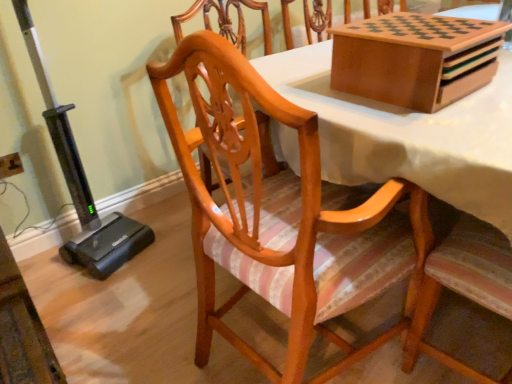
Question: In terms of width, does wooden game board at upper right look wider or thinner when compared to matte wood chair at center?

Choices:
 (A) wide
 (B) thin

Answer: (B)

Question: Would you say wooden game board at upper right is to the left or to the right of matte wood chair at center in the picture?

Choices:
 (A) left
 (B) right

Answer: (B)

Question: From their relative heights in the image, would you say wooden game board at upper right is taller or shorter than matte wood chair at center?

Choices:
 (A) short
 (B) tall

Answer: (A)

Question: Choose the correct answer: Is matte wood chair at center inside wooden game board at upper right or outside it?

Choices:
 (A) inside
 (B) outside

Answer: (B)

Question: In the image, is matte wood chair at center on the left side or the right side of wooden game board at upper right?

Choices:
 (A) right
 (B) left

Answer: (B)

Question: Considering the positions of matte wood chair at center and wooden game board at upper right in the image, is matte wood chair at center bigger or smaller than wooden game board at upper right?

Choices:
 (A) small
 (B) big

Answer: (B)

Question: Considering the positions of point (211, 198) and point (381, 81), is point (211, 198) closer or farther from the camera than point (381, 81)?

Choices:
 (A) farther
 (B) closer

Answer: (A)